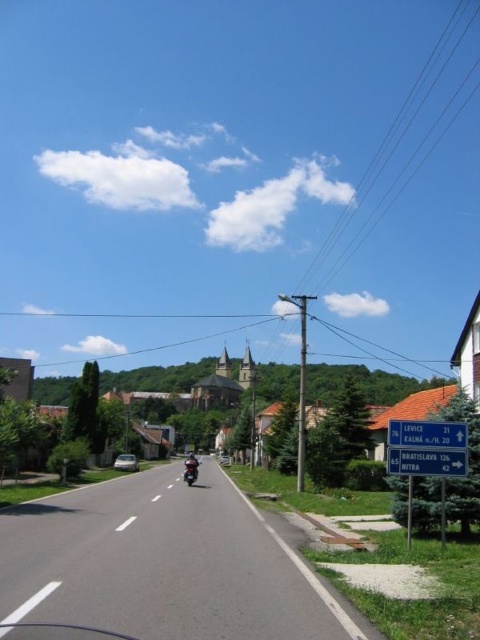
You are a tourist driving a shiny black motorcycle at center and want to check the directions on the blue plastic sign at upper right. Can you easily read the sign while riding the motorcycle?

The blue plastic sign at upper right is positioned over the shiny black motorcycle at center, meaning it is above the motorcycle. Since the sign is overhead, the tourist would need to look up to read it, which might be challenging while riding, especially at higher speeds. However, the sign is likely placed in a position where drivers can glance up briefly to read the distances to Levice, Kaln and Bratislava.

You are a tourist driving a motorcycle identical to the shiny black motorcycle at center and want to reach Levice. The road ahead has a dashed line on both sides. Can your motorcycle fit between the white plastic sign at center right and the edge of the road if you need to pass by the sign?

The white plastic sign at center right is thinner than the shiny black motorcycle at center, so the motorcycle cannot fit between the sign and the edge of the road since the sign is narrower than the motorcycle.